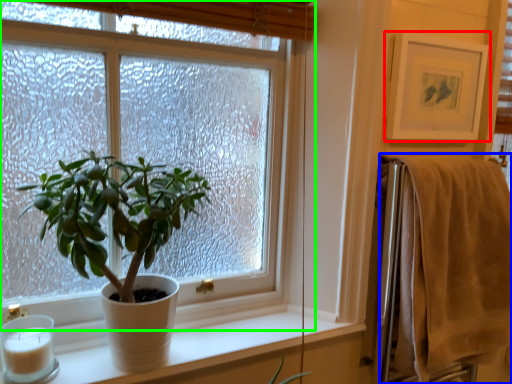
Question: Which object is the farthest from picture frame (highlighted by a red box)? Choose among these: bath towel (highlighted by a blue box) or window (highlighted by a green box).

Choices:
 (A) bath towel
 (B) window

Answer: (B)